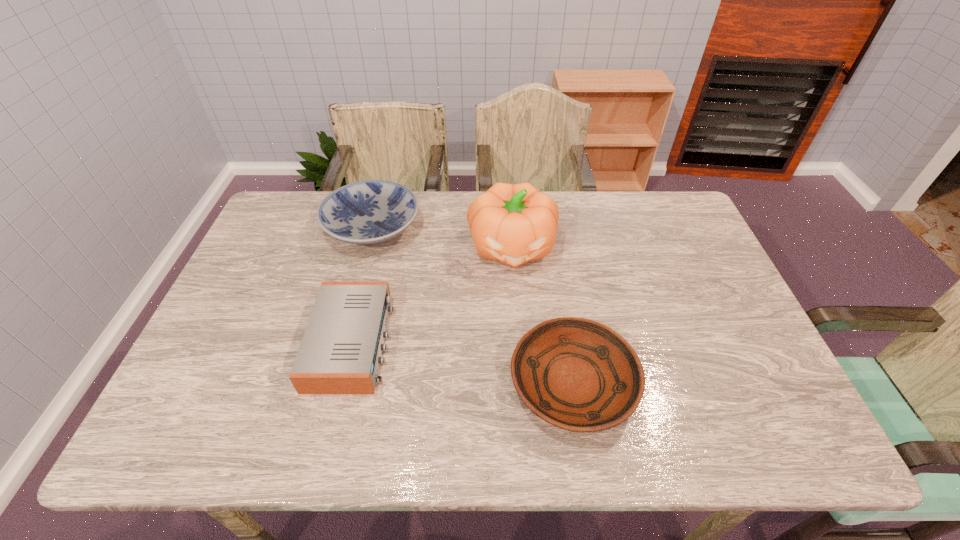
In order to click on pumpkin located at the far edge in this screenshot , I will do `click(513, 224)`.

Find the location of `plate that is at the far edge`. plate that is at the far edge is located at coordinates (371, 212).

The width and height of the screenshot is (960, 540). I want to click on object present at the near edge, so click(577, 374).

Locate an element on the screen. Image resolution: width=960 pixels, height=540 pixels. vacant space at the far edge of the desktop is located at coordinates (630, 228).

Find the location of `vacant space at the near edge of the desktop`. vacant space at the near edge of the desktop is located at coordinates (268, 429).

In the image, there is a desktop. Identify the location of vacant area at the left edge. The width and height of the screenshot is (960, 540). (186, 380).

At what (x,y) coordinates should I click in order to perform the action: click on free space at the right edge. Please return your answer as a coordinate pair (x, y). The height and width of the screenshot is (540, 960). Looking at the image, I should click on (708, 346).

In the image, there is a desktop. What are the coordinates of `free space at the far right corner` in the screenshot? It's located at (677, 210).

This screenshot has width=960, height=540. I want to click on vacant area that lies between the radio receiver and the tallest object, so click(x=432, y=294).

Where is `free area in between the radio receiver and the right plate`? This screenshot has width=960, height=540. free area in between the radio receiver and the right plate is located at coordinates (463, 363).